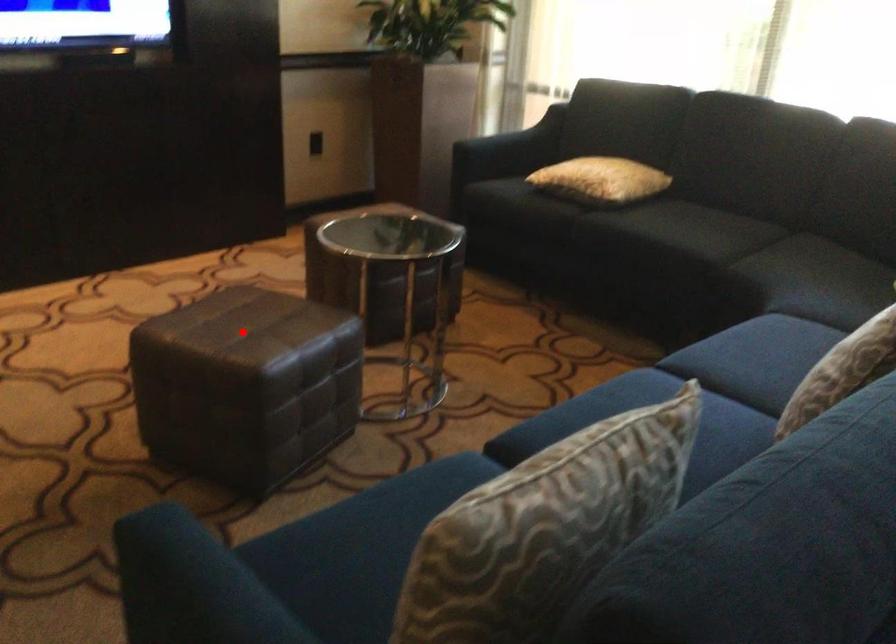
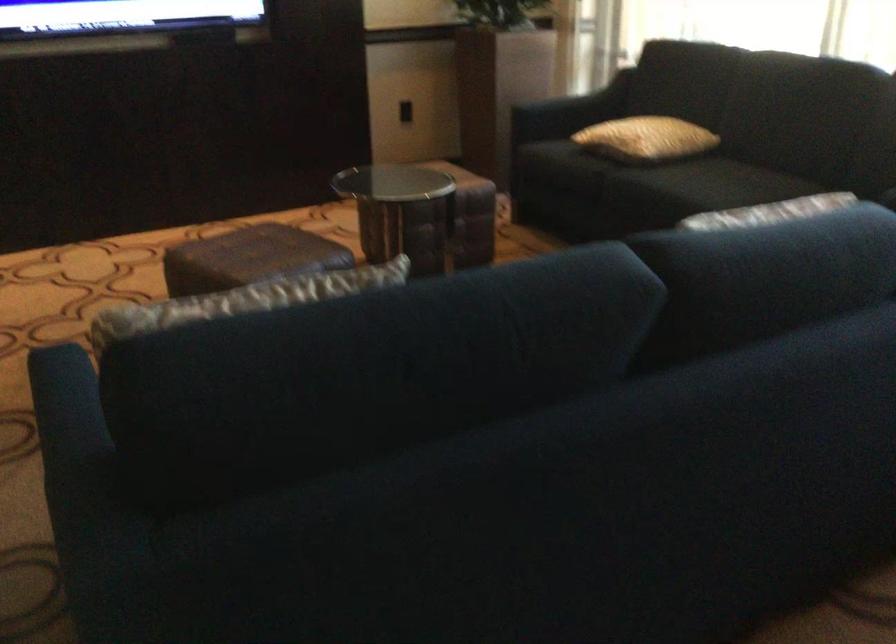
Question: I am providing you with two images of the same scene from different viewpoints. In image1, a red point is highlighted. Considering the same 3D point in image2, which of the following is correct?

Choices:
 (A) It is closer
 (B) It is farther

Answer: (B)